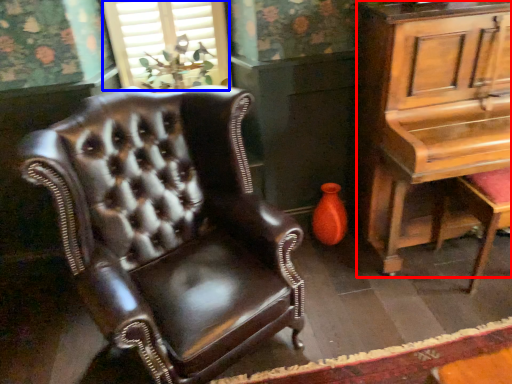
Question: Which point is closer to the camera, table (highlighted by a red box) or window (highlighted by a blue box)?

Choices:
 (A) table
 (B) window

Answer: (A)